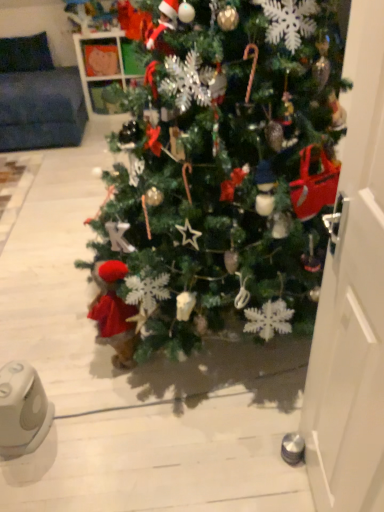
Question: From a real-world perspective, is green matte christmas tree at center physically below white plastic ipod at lower left?

Choices:
 (A) no
 (B) yes

Answer: (A)

Question: Is there a large distance between green matte christmas tree at center and white plastic ipod at lower left?

Choices:
 (A) yes
 (B) no

Answer: (B)

Question: Can we say green matte christmas tree at center lies outside white plastic ipod at lower left?

Choices:
 (A) yes
 (B) no

Answer: (A)

Question: From the image's perspective, is green matte christmas tree at center below white plastic ipod at lower left?

Choices:
 (A) yes
 (B) no

Answer: (B)

Question: Is green matte christmas tree at center closer to the viewer compared to white plastic ipod at lower left?

Choices:
 (A) yes
 (B) no

Answer: (A)

Question: In terms of height, does white plastic ipod at lower left look taller or shorter compared to green matte christmas tree at center?

Choices:
 (A) short
 (B) tall

Answer: (A)

Question: Is white plastic ipod at lower left wider or thinner than green matte christmas tree at center?

Choices:
 (A) wide
 (B) thin

Answer: (B)

Question: In terms of size, does white plastic ipod at lower left appear bigger or smaller than green matte christmas tree at center?

Choices:
 (A) big
 (B) small

Answer: (B)

Question: In the image, is white plastic ipod at lower left on the left side or the right side of green matte christmas tree at center?

Choices:
 (A) right
 (B) left

Answer: (B)

Question: Looking at their shapes, would you say white glossy door at right is wider or thinner than white plastic ipod at lower left?

Choices:
 (A) thin
 (B) wide

Answer: (A)

Question: In the image, is white glossy door at right positioned in front of or behind white plastic ipod at lower left?

Choices:
 (A) behind
 (B) front

Answer: (B)

Question: Is point (379, 318) closer or farther from the camera than point (4, 369)?

Choices:
 (A) closer
 (B) farther

Answer: (A)

Question: From the image's perspective, is white glossy door at right positioned above or below white plastic ipod at lower left?

Choices:
 (A) below
 (B) above

Answer: (B)

Question: Is white glossy door at right spatially inside green matte christmas tree at center, or outside of it?

Choices:
 (A) inside
 (B) outside

Answer: (B)

Question: Is point (380, 342) positioned closer to the camera than point (162, 347)?

Choices:
 (A) closer
 (B) farther

Answer: (A)